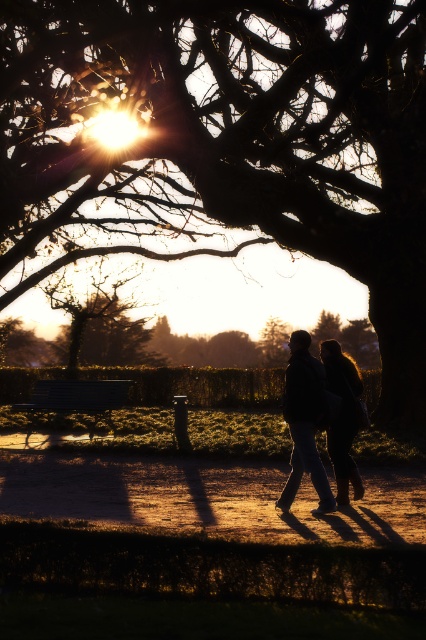
Can you confirm if brown textured tree at upper center is thinner than silky black hair at center?

In fact, brown textured tree at upper center might be wider than silky black hair at center.

Is brown textured tree at upper center to the left of silky black hair at center from the viewer's perspective?

Indeed, brown textured tree at upper center is positioned on the left side of silky black hair at center.

What do you see at coordinates (230, 140) in the screenshot? The width and height of the screenshot is (426, 640). I see `brown textured tree at upper center` at bounding box center [230, 140].

Find the location of a particular element. The height and width of the screenshot is (640, 426). brown textured tree at upper center is located at coordinates (230, 140).

Does brown textured tree at upper center appear on the right side of metallic silver bench at lower left?

Correct, you'll find brown textured tree at upper center to the right of metallic silver bench at lower left.

Can you confirm if brown textured tree at upper center is positioned above metallic silver bench at lower left?

Indeed, brown textured tree at upper center is positioned over metallic silver bench at lower left.

The image size is (426, 640). I want to click on brown textured tree at upper center, so 230,140.

Does dirt path at center have a smaller size compared to dark blue jeans at center?

Correct, dirt path at center occupies less space than dark blue jeans at center.

Is dirt path at center below dark blue jeans at center?

Indeed, dirt path at center is positioned under dark blue jeans at center.

Is point (138, 483) behind point (313, 420)?

Yes, it is.

Where is `dirt path at center`? The height and width of the screenshot is (640, 426). dirt path at center is located at coordinates (207, 499).